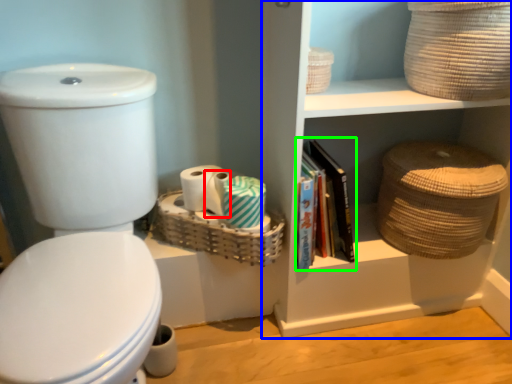
Question: Estimate the real-world distances between objects in this image. Which object is farther from toilet paper (highlighted by a red box), cabinet (highlighted by a blue box) or magazine (highlighted by a green box)?

Choices:
 (A) cabinet
 (B) magazine

Answer: (A)